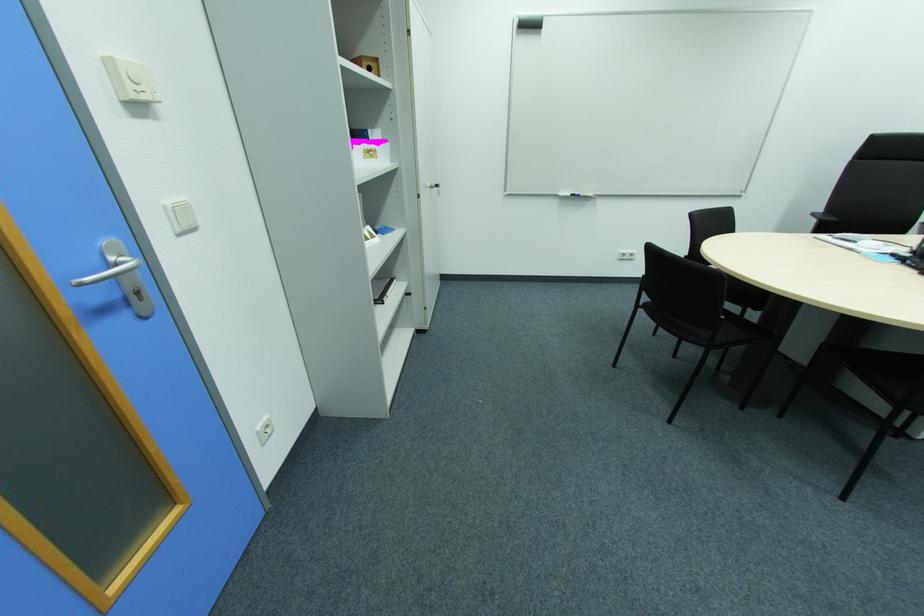
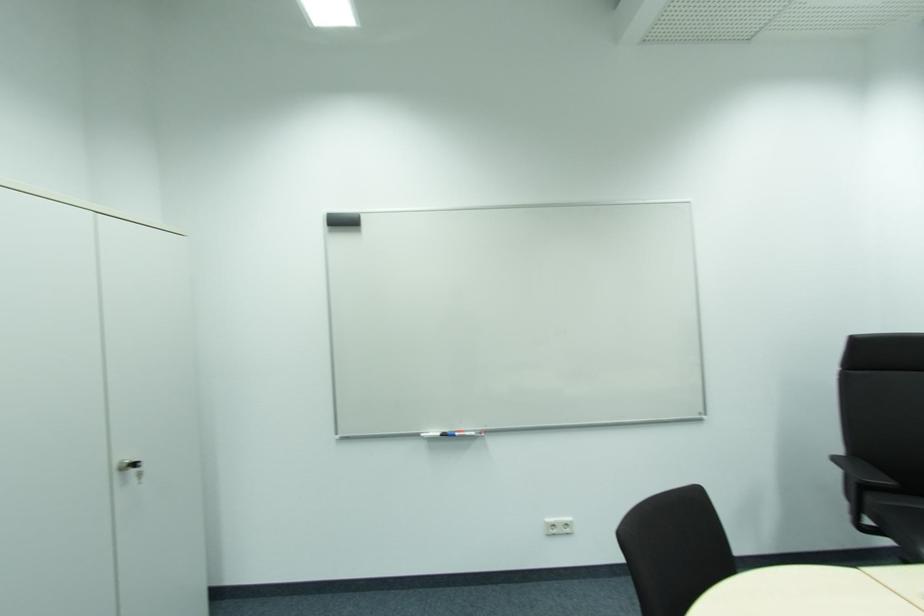
Locate, in the second image, the point that corresponds to [588,195] in the first image.

(464, 434)